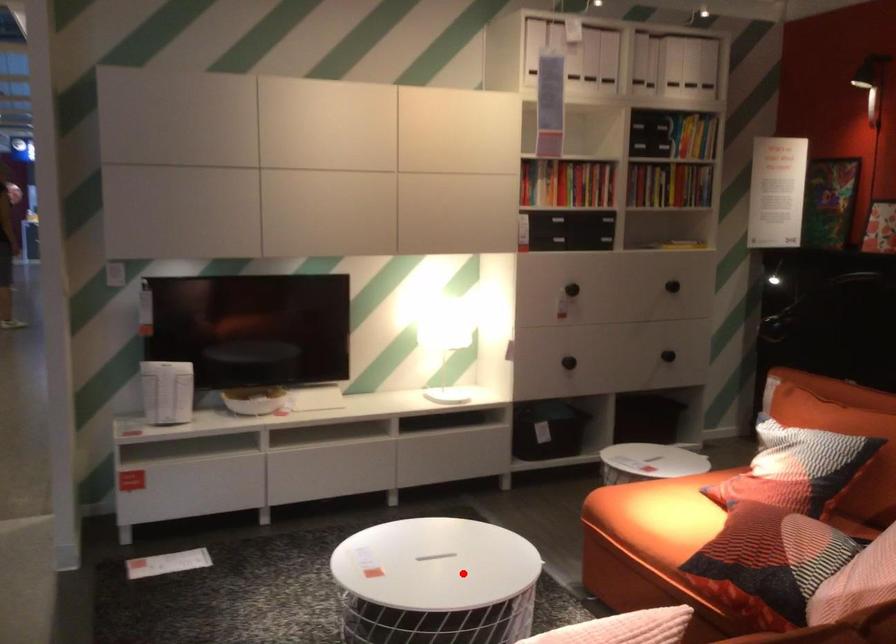
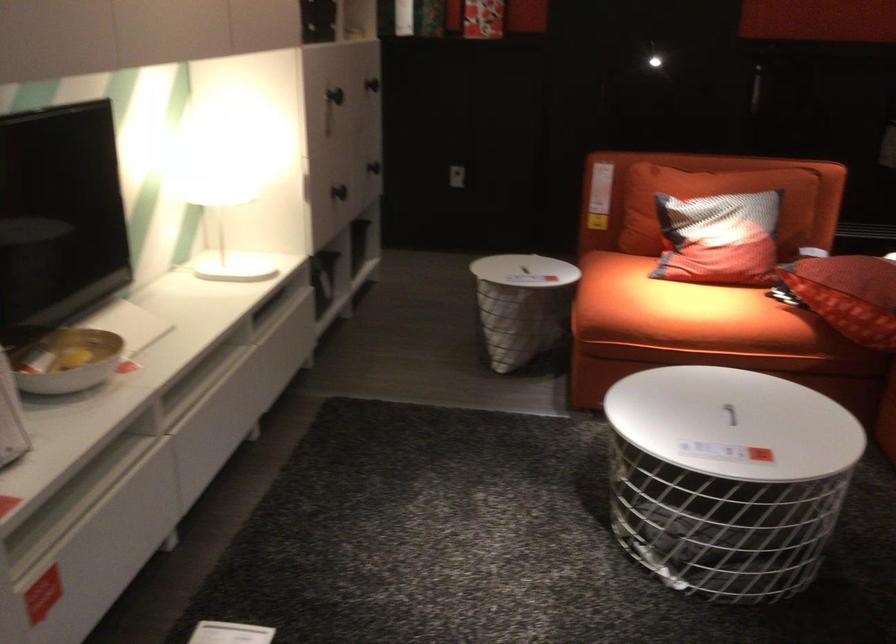
The point at the highlighted location is marked in the first image. Where is the corresponding point in the second image?

(729, 413)